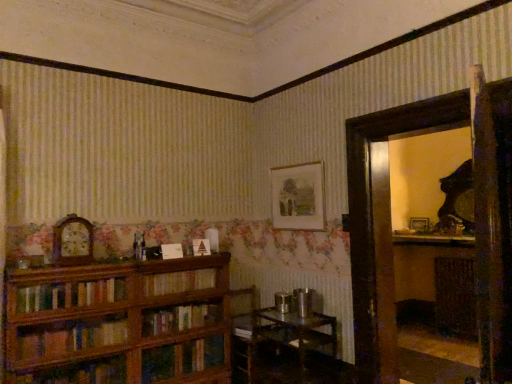
Question: Is the position of wooden shelf at right more distant than that of wooden picture frame at right, marked as the second picture frame in a top-to-bottom arrangement?

Choices:
 (A) no
 (B) yes

Answer: (A)

Question: Considering the relative sizes of wooden shelf at right and wooden picture frame at right, the second picture frame when ordered from front to back, in the image provided, is wooden shelf at right smaller than wooden picture frame at right, the second picture frame when ordered from front to back,?

Choices:
 (A) no
 (B) yes

Answer: (A)

Question: Is wooden shelf at right far from wooden picture frame at right, marked as the second picture frame in a top-to-bottom arrangement?

Choices:
 (A) yes
 (B) no

Answer: (A)

Question: Is wooden shelf at right positioned in front of wooden picture frame at right, the second picture frame when ordered from front to back?

Choices:
 (A) no
 (B) yes

Answer: (B)

Question: From the image's perspective, is wooden shelf at right located beneath wooden picture frame at right, which appears as the 1th picture frame when viewed from the right?

Choices:
 (A) no
 (B) yes

Answer: (B)

Question: In terms of height, does wooden picture frame at right, marked as the second picture frame in a top-to-bottom arrangement, look taller or shorter compared to metallic silver table at lower center?

Choices:
 (A) short
 (B) tall

Answer: (A)

Question: Visually, is wooden picture frame at right, which appears as the 1th picture frame when viewed from the right, positioned to the left or to the right of metallic silver table at lower center?

Choices:
 (A) left
 (B) right

Answer: (B)

Question: From the image's perspective, is wooden picture frame at right, marked as the second picture frame in a top-to-bottom arrangement, above or below metallic silver table at lower center?

Choices:
 (A) below
 (B) above

Answer: (B)

Question: Is point (425, 225) positioned closer to the camera than point (275, 312)?

Choices:
 (A) farther
 (B) closer

Answer: (A)

Question: Is matte white mantel at upper right bigger or smaller than metallic silver table at lower center?

Choices:
 (A) small
 (B) big

Answer: (A)

Question: Is matte white mantel at upper right taller or shorter than metallic silver table at lower center?

Choices:
 (A) tall
 (B) short

Answer: (B)

Question: From a real-world perspective, is matte white mantel at upper right physically located above or below metallic silver table at lower center?

Choices:
 (A) below
 (B) above

Answer: (B)

Question: Considering the positions of point (465, 243) and point (284, 327), is point (465, 243) closer or farther from the camera than point (284, 327)?

Choices:
 (A) farther
 (B) closer

Answer: (A)

Question: Considering the relative positions of wooden bookcase at left and wooden clock at left in the image provided, is wooden bookcase at left to the left or to the right of wooden clock at left?

Choices:
 (A) right
 (B) left

Answer: (A)

Question: From a real-world perspective, is wooden bookcase at left above or below wooden clock at left?

Choices:
 (A) above
 (B) below

Answer: (B)